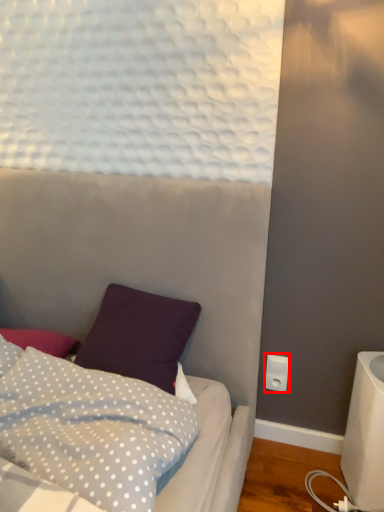
Question: From the image's perspective, where is electric outlet (annotated by the red box) located in relation to pillow in the image?

Choices:
 (A) below
 (B) above

Answer: (B)